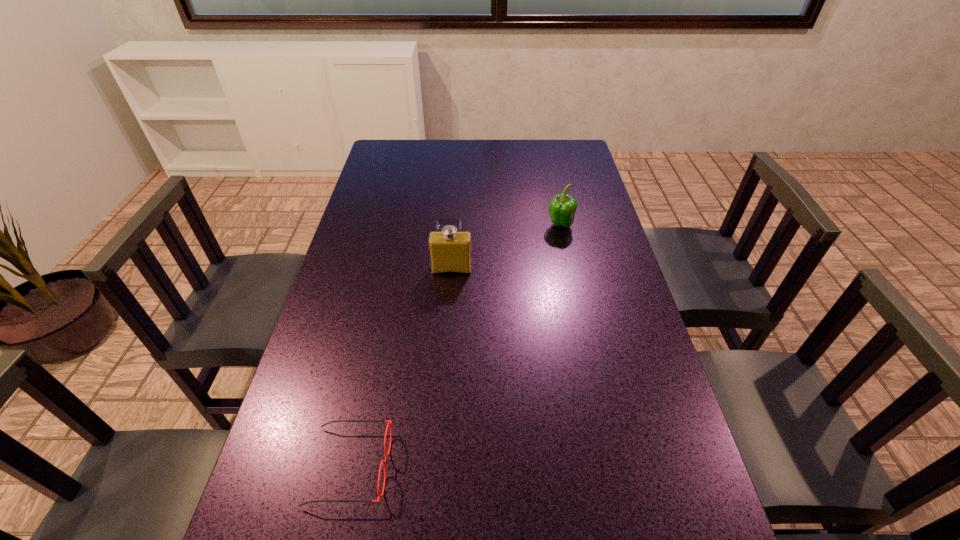
Identify the location of vacant point that satisfies the following two spatial constraints: 1. on the front-facing side of the second object from left to right; 2. on the front-facing side of the shortest object. This screenshot has height=540, width=960. (439, 466).

Image resolution: width=960 pixels, height=540 pixels. In order to click on vacant space that satisfies the following two spatial constraints: 1. on the front side of the second tallest object; 2. on the front-facing side of the spectacles in this screenshot , I will do `click(612, 466)`.

Locate an element on the screen. The image size is (960, 540). free space that satisfies the following two spatial constraints: 1. on the front-facing side of the perfume; 2. on the front-facing side of the shortest object is located at coordinates (439, 466).

Image resolution: width=960 pixels, height=540 pixels. Identify the location of blank space that satisfies the following two spatial constraints: 1. on the front-facing side of the tallest object; 2. on the front-facing side of the nearest object. [439, 466].